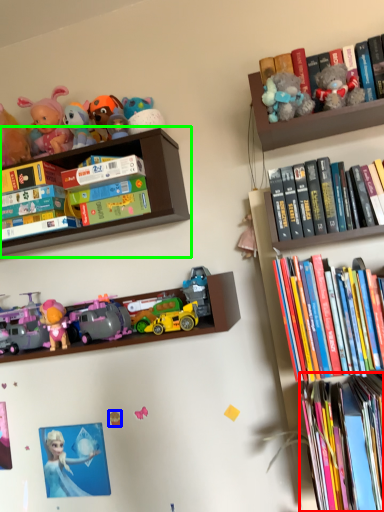
Question: Which object is positioned closest to book (highlighted by a red box)? Select from toy (highlighted by a blue box) and shelf (highlighted by a green box).

Choices:
 (A) toy
 (B) shelf

Answer: (A)